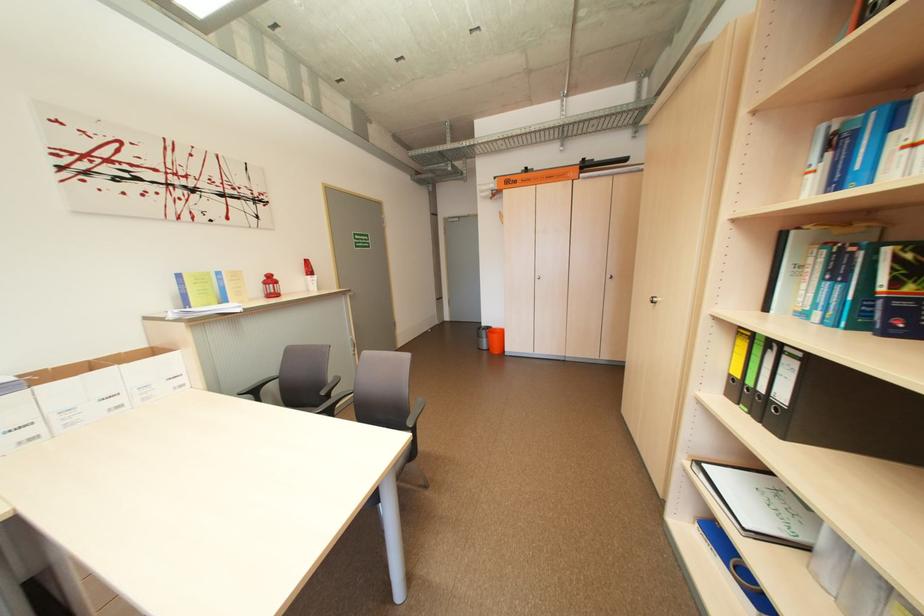
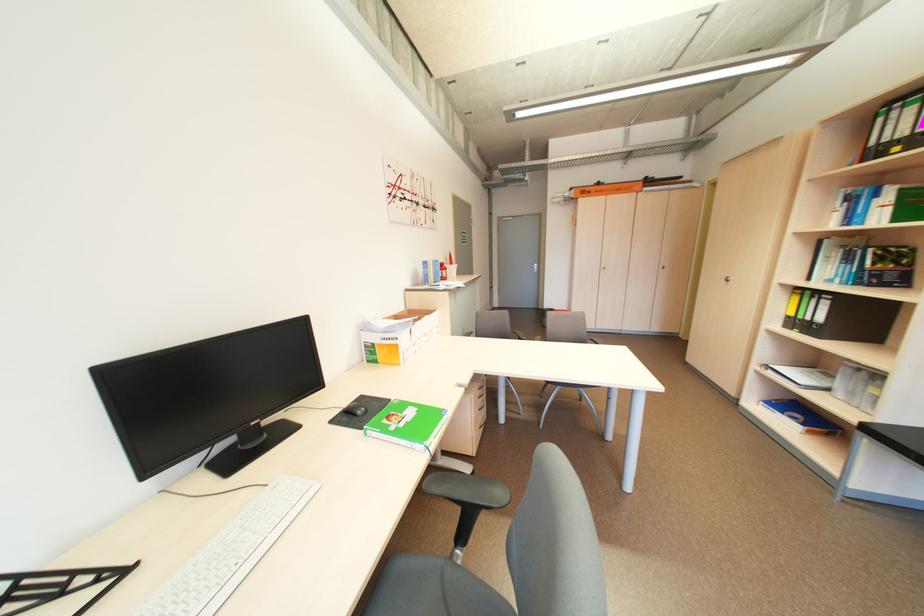
In the second image, find the point that corresponds to the point at 525,183 in the first image.

(599, 193)